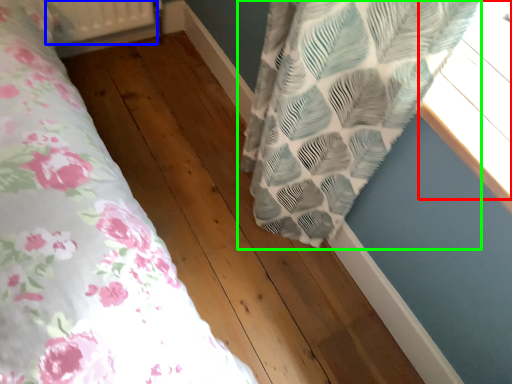
Question: Which object is the farthest from window (highlighted by a red box)? Choose among these: radiator (highlighted by a blue box) or curtain (highlighted by a green box).

Choices:
 (A) radiator
 (B) curtain

Answer: (A)